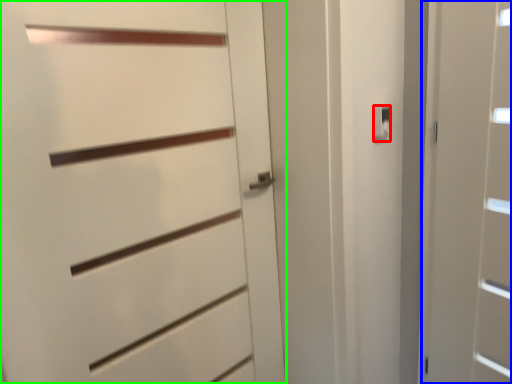
Question: Considering the real-world distances, which object is closest to latch (highlighted by a red box)? door (highlighted by a blue box) or door (highlighted by a green box).

Choices:
 (A) door
 (B) door

Answer: (A)